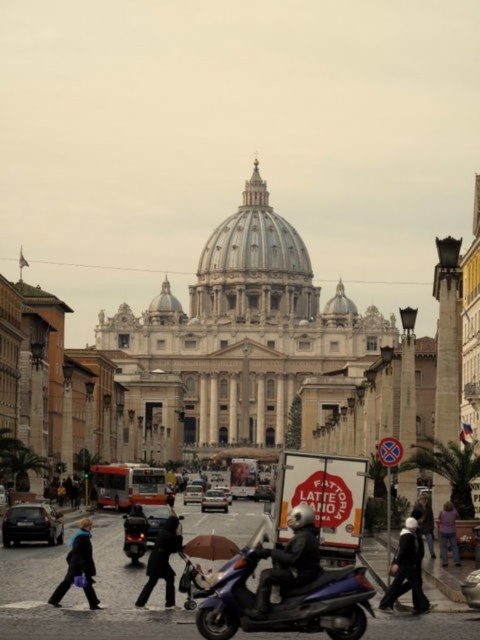
You are a pedestrian standing on the sidewalk in front of St. Peter Basilica. You see a white matte van at center and a white matte car at center. Which one is closer to you?

The white matte van at center is closer to the viewer than the white matte car at center.

You are a photographer standing in front of St. Peter Basilica and want to take a photo of the blue fabric jacket at lower left and the white matte van at center. Which object appears taller in the photo?

The blue fabric jacket at lower left is taller than the white matte van at center in the photo.

You are standing at the point marked as point [79,566] in the image. What object is located at that exact point?

The blue fabric jacket at lower left is located at point [79,566].